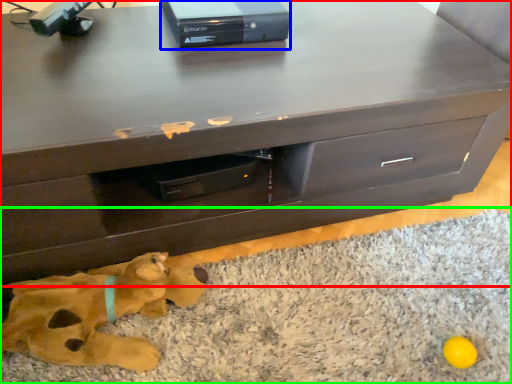
Question: Which object is the farthest from chest of drawers (highlighted by a red box)? Choose among these: equipment (highlighted by a blue box) or mat (highlighted by a green box).

Choices:
 (A) equipment
 (B) mat

Answer: (B)